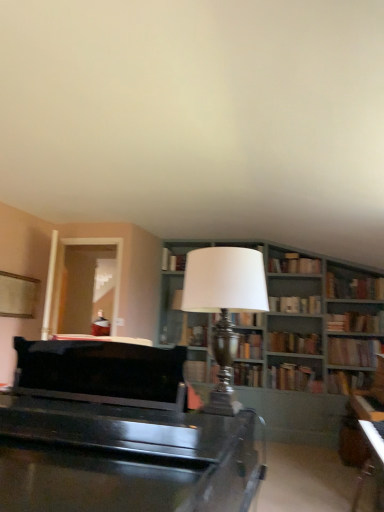
Question: From a real-world perspective, does clear glass door at left stand above hardcover book at upper right, the 5th book from the top?

Choices:
 (A) no
 (B) yes

Answer: (B)

Question: Is clear glass door at left positioned before hardcover book at upper right, the 5th book from the top?

Choices:
 (A) yes
 (B) no

Answer: (A)

Question: Is clear glass door at left thinner than hardcover book at upper right, the 5th book from the top?

Choices:
 (A) yes
 (B) no

Answer: (A)

Question: Is the surface of clear glass door at left in direct contact with hardcover book at upper right, the 5th book from the top?

Choices:
 (A) no
 (B) yes

Answer: (A)

Question: From the image's perspective, is clear glass door at left located above hardcover book at upper right, the 5th book from the top?

Choices:
 (A) yes
 (B) no

Answer: (A)

Question: Considering the positions of hardcover book at center, placed as the fourth book when sorted from top to bottom, and hardcover book at upper right, the 13th book when ordered from bottom to top, in the image, is hardcover book at center, placed as the fourth book when sorted from top to bottom, bigger or smaller than hardcover book at upper right, the 13th book when ordered from bottom to top,?

Choices:
 (A) big
 (B) small

Answer: (B)

Question: Considering the relative positions of hardcover book at center, placed as the fourth book when sorted from top to bottom, and hardcover book at upper right, which appears as the first book when viewed from the top, in the image provided, is hardcover book at center, placed as the fourth book when sorted from top to bottom, to the left or to the right of hardcover book at upper right, which appears as the first book when viewed from the top,?

Choices:
 (A) left
 (B) right

Answer: (A)

Question: Does point (307, 300) appear closer or farther from the camera than point (296, 253)?

Choices:
 (A) closer
 (B) farther

Answer: (B)

Question: In the image, is hardcover book at center, placed as the fourth book when sorted from top to bottom, positioned in front of or behind hardcover book at upper right, the 13th book when ordered from bottom to top?

Choices:
 (A) behind
 (B) front

Answer: (B)

Question: Would you say wooden bookshelf at center is to the left or to the right of hardcover book at center, positioned as the 9th book in top-to-bottom order, in the picture?

Choices:
 (A) right
 (B) left

Answer: (A)

Question: Is wooden bookshelf at center bigger or smaller than hardcover book at center, which ranks as the fifth book in bottom-to-top order?

Choices:
 (A) big
 (B) small

Answer: (A)

Question: From a real-world perspective, is wooden bookshelf at center physically located above or below hardcover book at center, positioned as the 9th book in top-to-bottom order?

Choices:
 (A) above
 (B) below

Answer: (A)

Question: From the image's perspective, is wooden bookshelf at center located above or below hardcover book at center, which ranks as the fifth book in bottom-to-top order?

Choices:
 (A) above
 (B) below

Answer: (A)

Question: From the image's perspective, is hardcover book at upper right, the 13th book when ordered from bottom to top, above or below hardcover book at center, placed as the fourth book when sorted from top to bottom?

Choices:
 (A) below
 (B) above

Answer: (B)

Question: Is point (314, 261) closer or farther from the camera than point (269, 303)?

Choices:
 (A) closer
 (B) farther

Answer: (A)